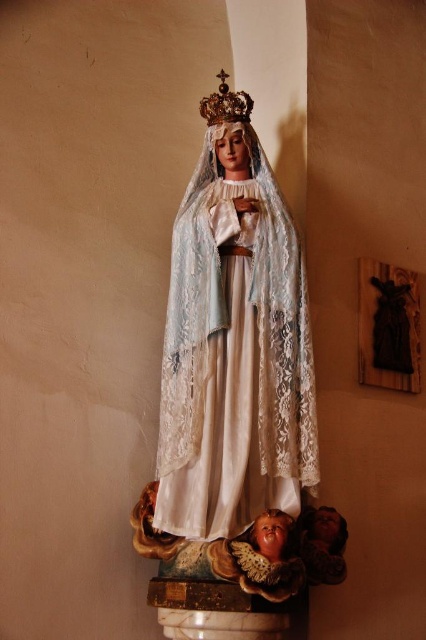
You are an art conservator examining the religious statue. You notice the white lace statue at center and the gold metallic crown at upper center. Which object is positioned closer to your viewpoint?

The white lace statue at center is closer to the viewer than the gold metallic crown at upper center.

In the scene shown: You are an interior designer planning to place a new decorative item on the wall. The current statue is at position coordinates. Do you need to adjust the placement of the new item to avoid overlapping with the white lace statue at center?

The white lace statue at center is located at point (238, 387), so you should avoid placing the new item at that coordinate to prevent overlap.